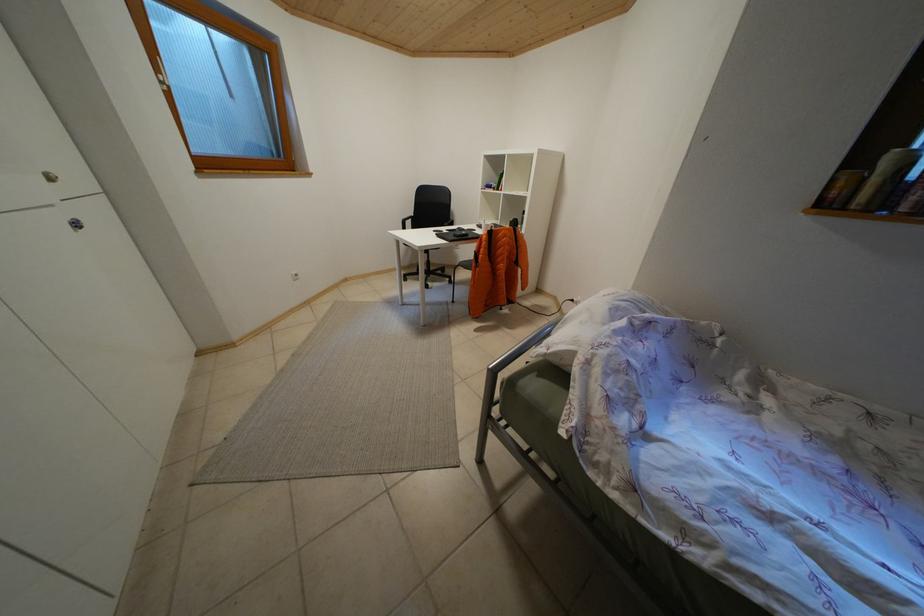
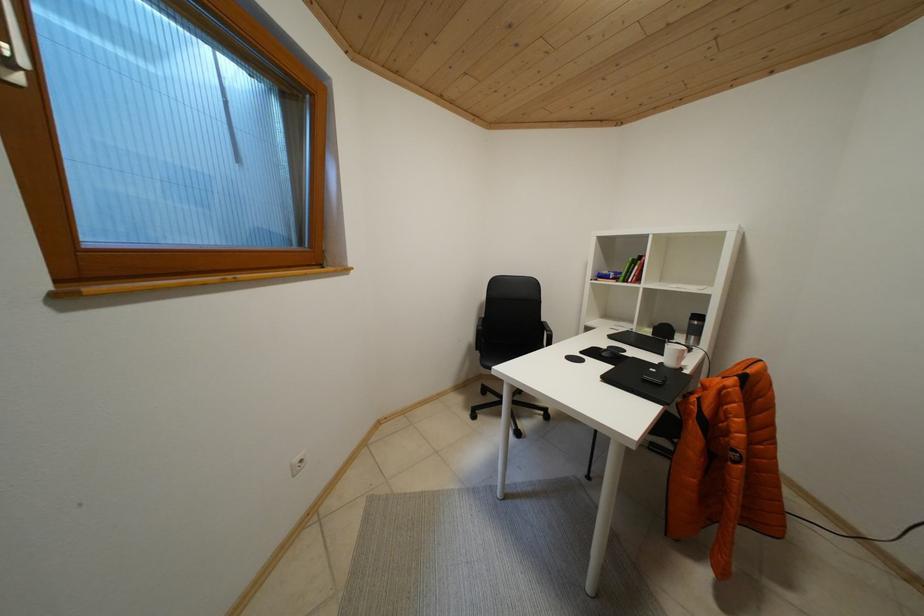
Which direction would the cameraman need to move to produce the second image?

The cameraman walked toward left, forward.